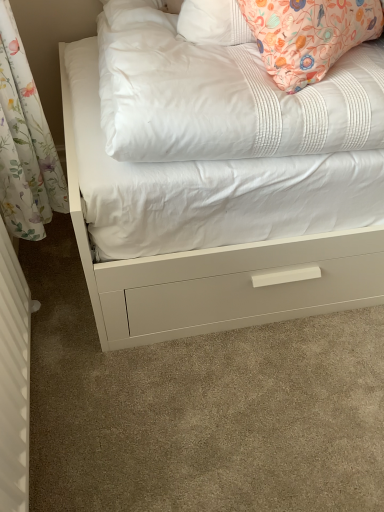
The height and width of the screenshot is (512, 384). I want to click on free space behind white textured radiator at left, so [x=64, y=318].